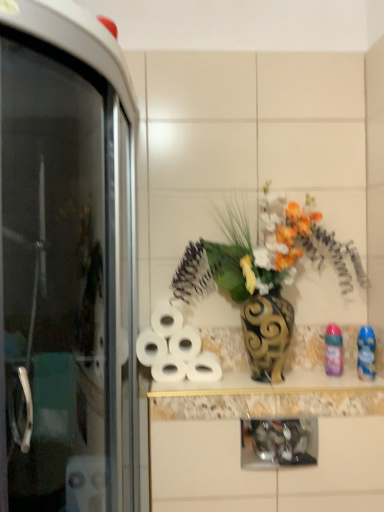
Question: Is transparent glass screen door at left facing towards white matte toilet paper at center, positioned as the 3th toilet paper in bottom-to-top order?

Choices:
 (A) yes
 (B) no

Answer: (B)

Question: From the image's perspective, is transparent glass screen door at left on white matte toilet paper at center, marked as the 3th toilet paper in a top-to-bottom arrangement?

Choices:
 (A) yes
 (B) no

Answer: (A)

Question: Is transparent glass screen door at left surrounding white matte toilet paper at center, positioned as the 3th toilet paper in bottom-to-top order?

Choices:
 (A) yes
 (B) no

Answer: (A)

Question: Is transparent glass screen door at left at the right side of white matte toilet paper at center, positioned as the 3th toilet paper in bottom-to-top order?

Choices:
 (A) no
 (B) yes

Answer: (A)

Question: From a real-world perspective, is transparent glass screen door at left positioned under white matte toilet paper at center, positioned as the 3th toilet paper in bottom-to-top order, based on gravity?

Choices:
 (A) yes
 (B) no

Answer: (B)

Question: From their relative heights in the image, would you say metallic gold vase at center is taller or shorter than white matte toilet paper at center, which is counted as the 2th toilet paper, starting from the top?

Choices:
 (A) short
 (B) tall

Answer: (B)

Question: Considering the positions of metallic gold vase at center and white matte toilet paper at center, which is counted as the 2th toilet paper, starting from the top, in the image, is metallic gold vase at center bigger or smaller than white matte toilet paper at center, which is counted as the 2th toilet paper, starting from the top,?

Choices:
 (A) small
 (B) big

Answer: (B)

Question: Is point (258, 284) positioned closer to the camera than point (183, 352)?

Choices:
 (A) farther
 (B) closer

Answer: (B)

Question: Visually, is metallic gold vase at center positioned to the left or to the right of white matte toilet paper at center, which is counted as the 2th toilet paper, starting from the top?

Choices:
 (A) right
 (B) left

Answer: (A)

Question: In the image, is white matte toilet paper at center, which is counted as the 2th toilet paper, starting from the top, on the left side or the right side of white matte toilet paper at center, placed as the fifth toilet paper when sorted from top to bottom?

Choices:
 (A) left
 (B) right

Answer: (B)

Question: Looking at their shapes, would you say white matte toilet paper at center, arranged as the 4th toilet paper when ordered from the bottom, is wider or thinner than white matte toilet paper at center, placed as the fifth toilet paper when sorted from top to bottom?

Choices:
 (A) thin
 (B) wide

Answer: (B)

Question: Is white matte toilet paper at center, which is counted as the 2th toilet paper, starting from the top, inside the boundaries of white matte toilet paper at center, placed as the fifth toilet paper when sorted from top to bottom, or outside?

Choices:
 (A) outside
 (B) inside

Answer: (A)

Question: From a real-world perspective, is white matte toilet paper at center, arranged as the 4th toilet paper when ordered from the bottom, positioned above or below white matte toilet paper at center, the first toilet paper positioned from the bottom?

Choices:
 (A) above
 (B) below

Answer: (A)

Question: Considering the positions of white matte toilet paper at center, marked as the 3th toilet paper in a top-to-bottom arrangement, and white matte toilet paper at center, which appears as the first toilet paper when viewed from the top, in the image, is white matte toilet paper at center, marked as the 3th toilet paper in a top-to-bottom arrangement, taller or shorter than white matte toilet paper at center, which appears as the first toilet paper when viewed from the top,?

Choices:
 (A) short
 (B) tall

Answer: (A)

Question: From a real-world perspective, is white matte toilet paper at center, marked as the 3th toilet paper in a top-to-bottom arrangement, above or below white matte toilet paper at center, which appears as the first toilet paper when viewed from the top?

Choices:
 (A) below
 (B) above

Answer: (A)